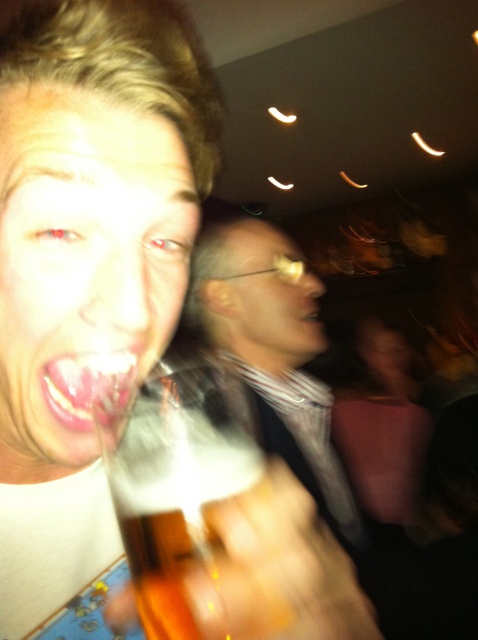
You are a photographer trying to capture a closeup of the matte plastic glasses at center and the matte white teeth at center in the scene. Which object would you need to focus on first if you want to ensure both are in focus?

The matte plastic glasses at center is much taller than the matte white teeth at center, so you should focus on the matte plastic glasses at center first to ensure both are in focus.

You are a photographer adjusting the focus of your camera. The camera is set to focus on the matte skin face at center. If the depth of field allows for objects within 10 inches to be in focus, will the viewer be in focus?

The matte skin face at center and viewer are 9.83 inches apart from each other. Since the depth of field covers objects within 10 inches, the viewer would be within the focused range and thus in focus.